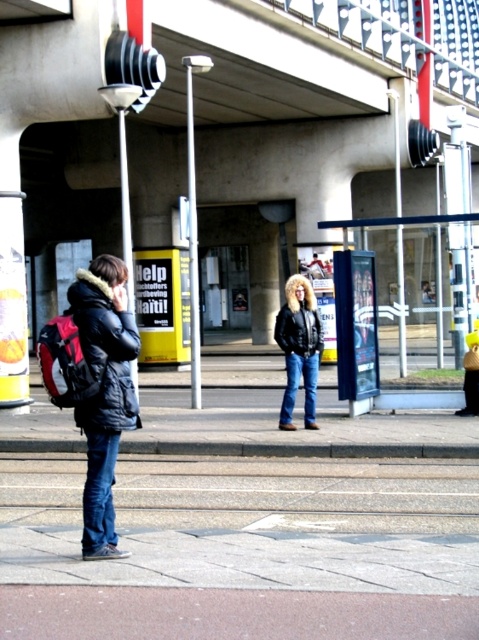
Who is more distant from viewer, (202, 65) or (398, 92)?

Point (398, 92)

You are a GUI agent. You are given a task and a screenshot of the screen. Output one action in this format:
    pyautogui.click(x=<x>, y=<y>)
    Task: Click on the metallic pole at center
    
    Given the screenshot: What is the action you would take?
    pyautogui.click(x=193, y=234)

Where is `metallic pole at center`? This screenshot has width=479, height=640. metallic pole at center is located at coordinates click(x=193, y=234).

Where is `metallic pole at center`? metallic pole at center is located at coordinates (193, 234).

Does metallic pole at center lie in front of black leather jacket at center?

That is False.

The height and width of the screenshot is (640, 479). Find the location of `metallic pole at center`. metallic pole at center is located at coordinates (193, 234).

At what (x,y) coordinates should I click in order to perform the action: click on metallic pole at center. Please return your answer as a coordinate pair (x, y). Looking at the image, I should click on (193, 234).

Is blue plastic bus stop at center closer to the viewer compared to black leather jacket at center?

That is False.

Does blue plastic bus stop at center have a greater height compared to black leather jacket at center?

Yes, blue plastic bus stop at center is taller than black leather jacket at center.

What do you see at coordinates (435, 264) in the screenshot? The width and height of the screenshot is (479, 640). I see `blue plastic bus stop at center` at bounding box center [435, 264].

Identify the location of blue plastic bus stop at center. This screenshot has width=479, height=640. (435, 264).